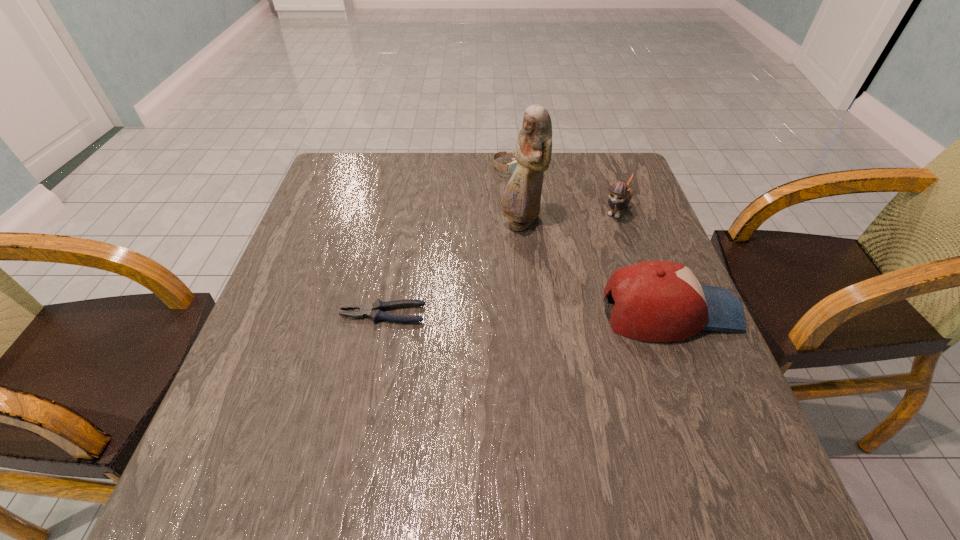
At what (x,y) coordinates should I click in order to perform the action: click on vacant space on the desktop that is between the shortest object and the baseball cap and is positioned on the front-facing side of the kitten. Please return your answer as a coordinate pair (x, y). Looking at the image, I should click on (549, 313).

This screenshot has height=540, width=960. In order to click on free space on the desktop that is between the pliers and the baseball cap and is positioned on the front-facing side of the tallest object in this screenshot , I will do `click(496, 313)`.

Identify the location of vacant space on the desktop that is between the pliers and the baseball cap and is positioned on the face of the farthest object. The image size is (960, 540). (503, 313).